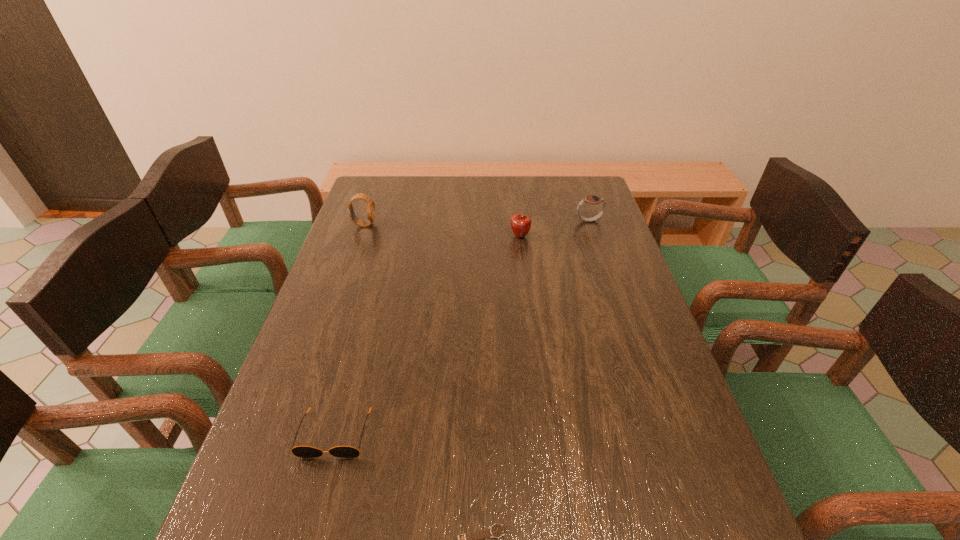
Identify the location of the closest watch to the leftmost watch. (591, 199).

Image resolution: width=960 pixels, height=540 pixels. Find the location of `watch that is the closest one to the nearest watch`. watch that is the closest one to the nearest watch is located at coordinates (370, 203).

This screenshot has width=960, height=540. I want to click on free space that satisfies the following two spatial constraints: 1. on the front side of the second tallest watch; 2. on the face of the leftmost watch, so 590,225.

You are a GUI agent. You are given a task and a screenshot of the screen. Output one action in this format:
    pyautogui.click(x=<x>, y=<y>)
    Task: Click on the free spot that satisfies the following two spatial constraints: 1. on the face of the fourth object from left to right; 2. on the left side of the leftmost watch
    
    Given the screenshot: What is the action you would take?
    pyautogui.click(x=360, y=237)